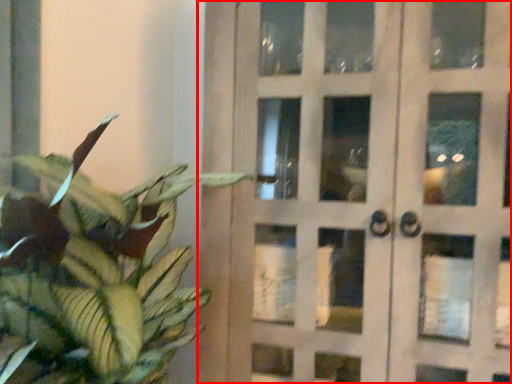
Question: Considering the relative positions of door (annotated by the red box) and houseplant in the image provided, where is door (annotated by the red box) located with respect to the staircase?

Choices:
 (A) left
 (B) right

Answer: (B)